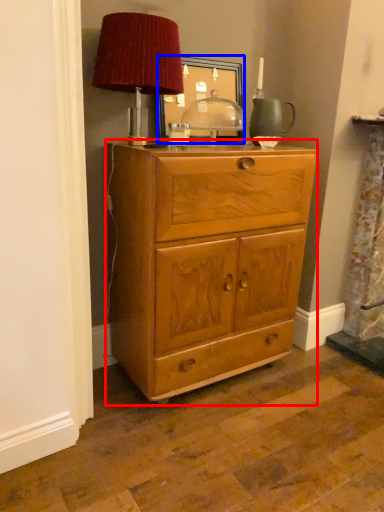
Question: Which point is further to the camera, chest of drawers (highlighted by a red box) or picture frame (highlighted by a blue box)?

Choices:
 (A) chest of drawers
 (B) picture frame

Answer: (B)